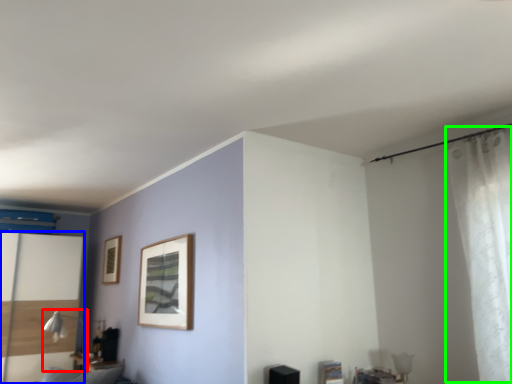
Question: Based on their relative distances, which object is farther from table lamp (highlighted by a red box)? Choose from screen door (highlighted by a blue box) and curtain (highlighted by a green box).

Choices:
 (A) screen door
 (B) curtain

Answer: (B)